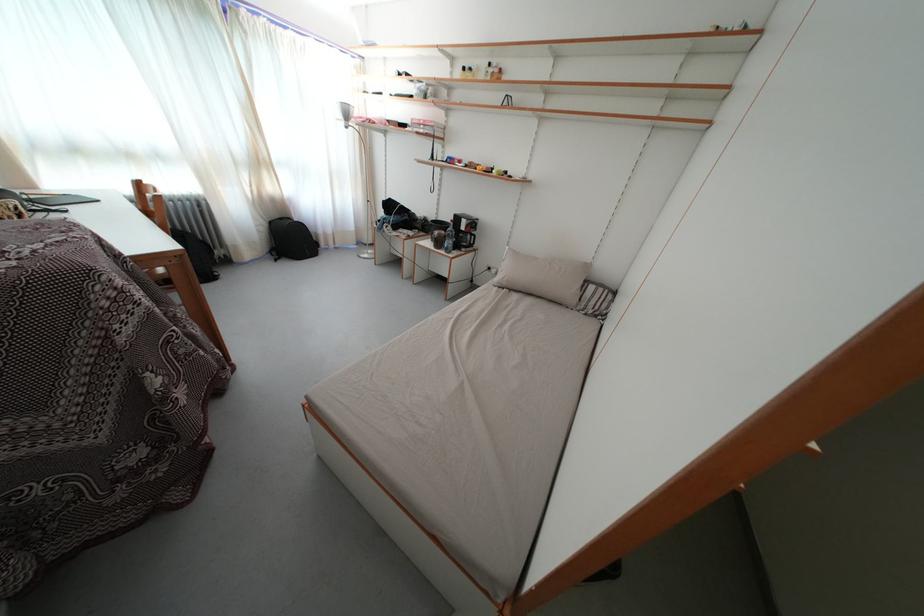
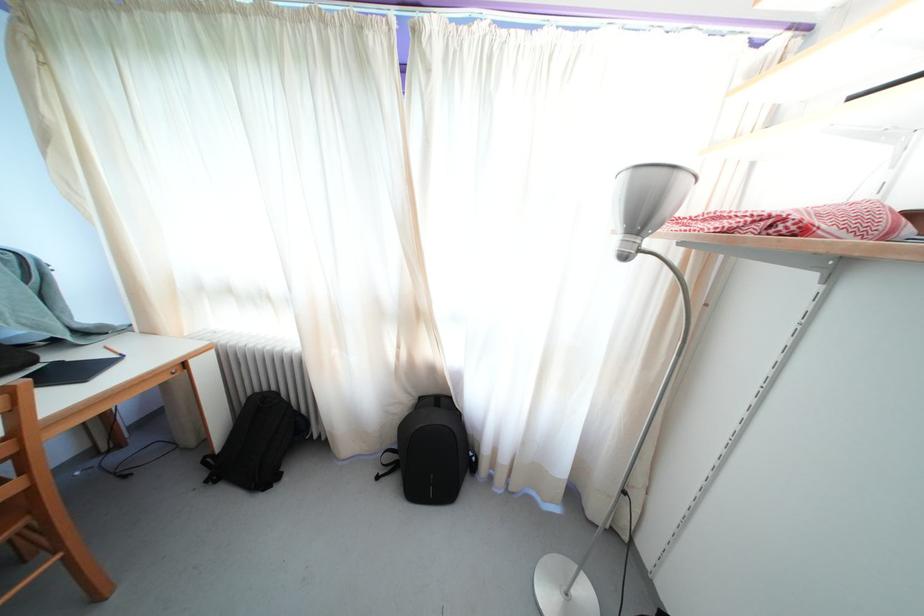
The point at (266, 168) is marked in the first image. Where is the corresponding point in the second image?

(421, 321)